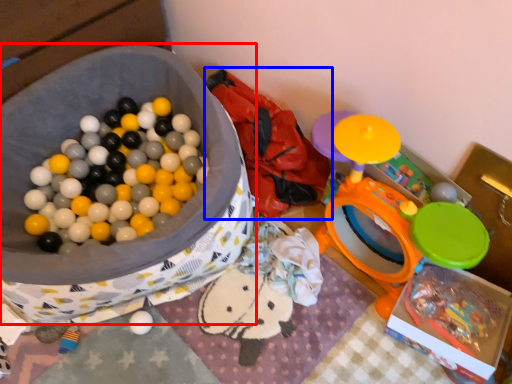
Question: Among these objects, which one is farthest to the camera, storage box (highlighted by a red box) or bean bag chair (highlighted by a blue box)?

Choices:
 (A) storage box
 (B) bean bag chair

Answer: (B)